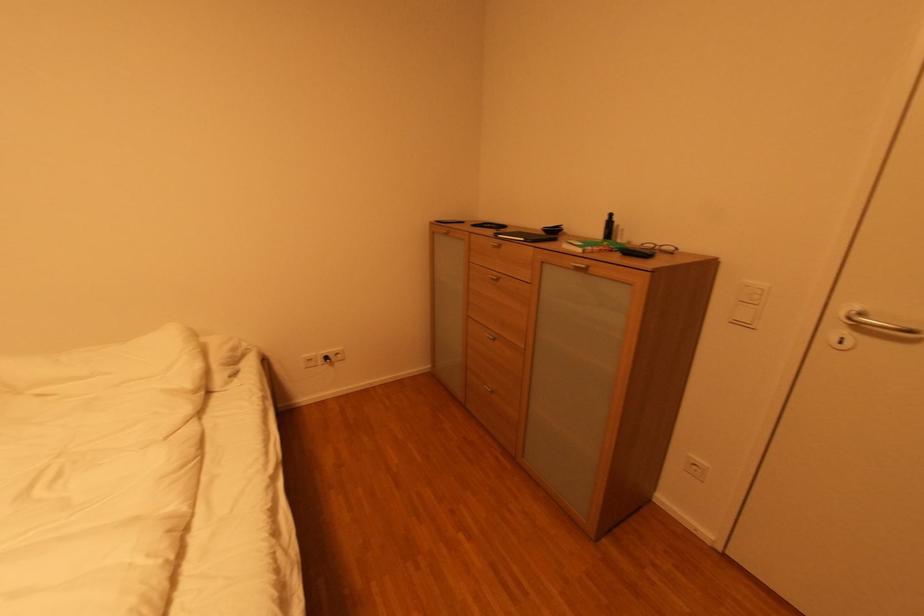
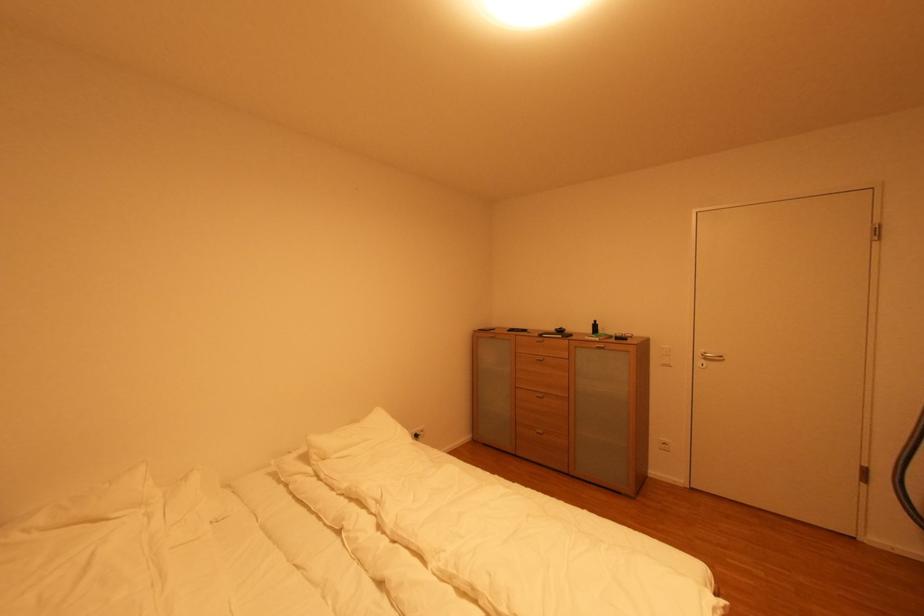
The point at [742,325] is marked in the first image. Where is the corresponding point in the second image?

(670, 367)